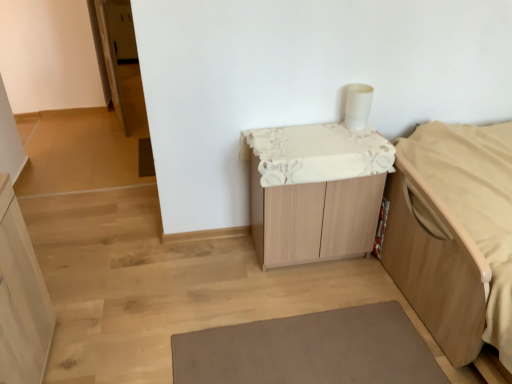
The width and height of the screenshot is (512, 384). What are the coordinates of `vacant area to the right of light wood cabinet at left` in the screenshot? It's located at (115, 349).